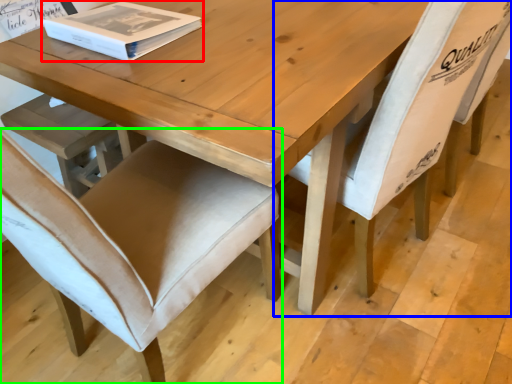
Question: Which object is the closest to the box (highlighted by a red box)? Choose among these: chair (highlighted by a blue box) or chair (highlighted by a green box).

Choices:
 (A) chair
 (B) chair

Answer: (B)